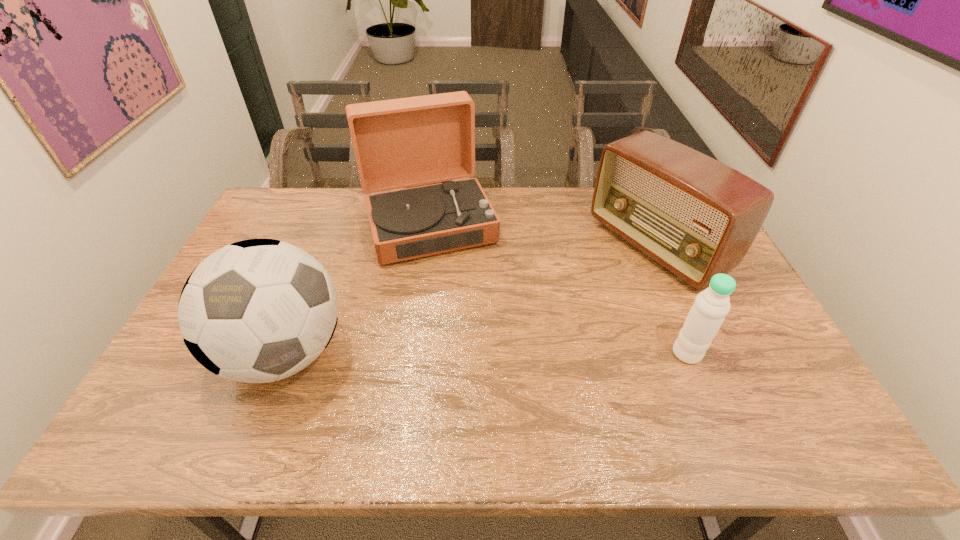
I want to click on free spot between the phonograph record and the soccer ball, so click(357, 288).

At what (x,y) coordinates should I click in order to perform the action: click on vacant point located between the water bottle and the radio receiver. Please return your answer as a coordinate pair (x, y). The width and height of the screenshot is (960, 540). Looking at the image, I should click on (672, 300).

Select which object appears as the closest to the soccer ball. Please provide its 2D coordinates. Your answer should be formatted as a tuple, i.e. [(x, y)], where the tuple contains the x and y coordinates of a point satisfying the conditions above.

[(398, 143)]

Identify which object is located as the third nearest to the water bottle. Please provide its 2D coordinates. Your answer should be formatted as a tuple, i.e. [(x, y)], where the tuple contains the x and y coordinates of a point satisfying the conditions above.

[(259, 310)]

Identify the location of free space that satisfies the following two spatial constraints: 1. on the front side of the phonograph record; 2. on the right side of the radio receiver. This screenshot has height=540, width=960. (426, 246).

At what (x,y) coordinates should I click in order to perform the action: click on free space that satisfies the following two spatial constraints: 1. on the back side of the water bottle; 2. on the right side of the radio receiver. Please return your answer as a coordinate pair (x, y). This screenshot has width=960, height=540. Looking at the image, I should click on (643, 246).